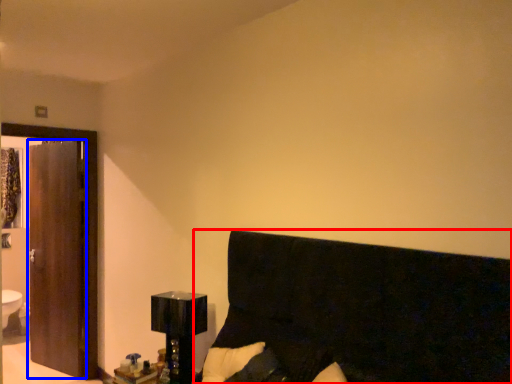
Question: Which point is closer to the camera, furniture (highlighted by a red box) or screen door (highlighted by a blue box)?

Choices:
 (A) furniture
 (B) screen door

Answer: (A)